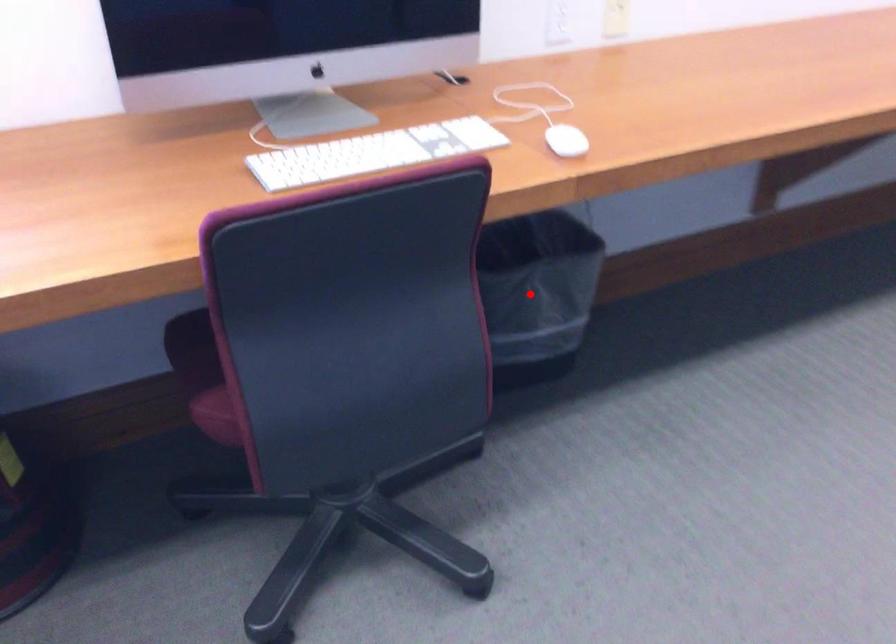
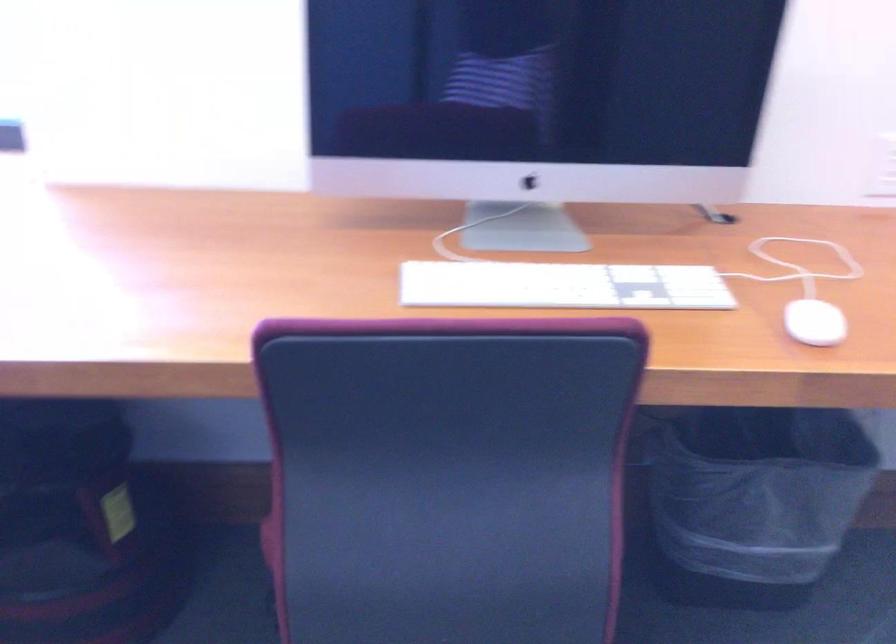
Where in the second image is the point corresponding to the highlighted location from the first image?

(753, 500)